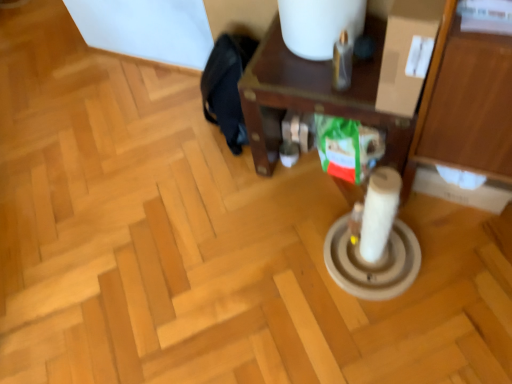
You are a GUI agent. You are given a task and a screenshot of the screen. Output one action in this format:
    pyautogui.click(x=<x>, y=<y>)
    Task: Click on the free point in front of brown wooden side table at center
    Image resolution: width=512 pixels, height=384 pixels.
    Given the screenshot: What is the action you would take?
    pyautogui.click(x=360, y=263)